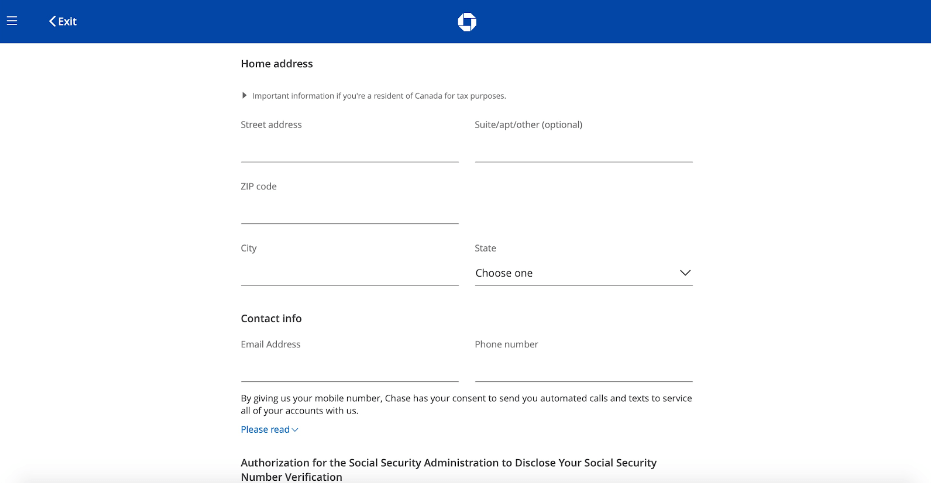
Locate an element on the screen. This screenshot has height=483, width=931. exit button is located at coordinates (68, 24).